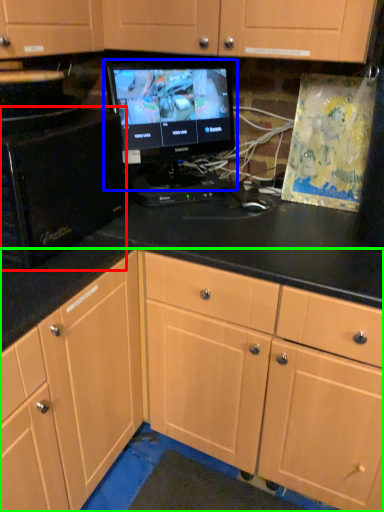
Question: Which object is positioned closest to desktop computer (highlighted by a red box)? Select from computer monitor (highlighted by a blue box) and cabinetry (highlighted by a green box).

Choices:
 (A) computer monitor
 (B) cabinetry

Answer: (A)